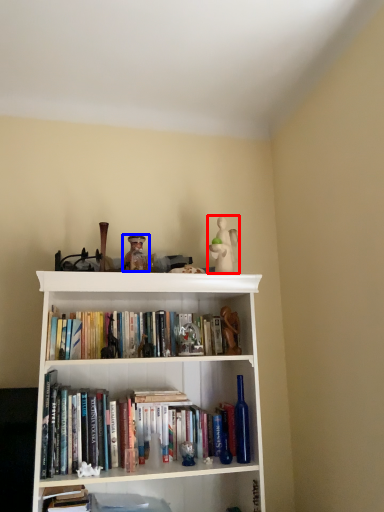
Question: Which point is closer to the camera, toy (highlighted by a red box) or toy (highlighted by a blue box)?

Choices:
 (A) toy
 (B) toy

Answer: (B)